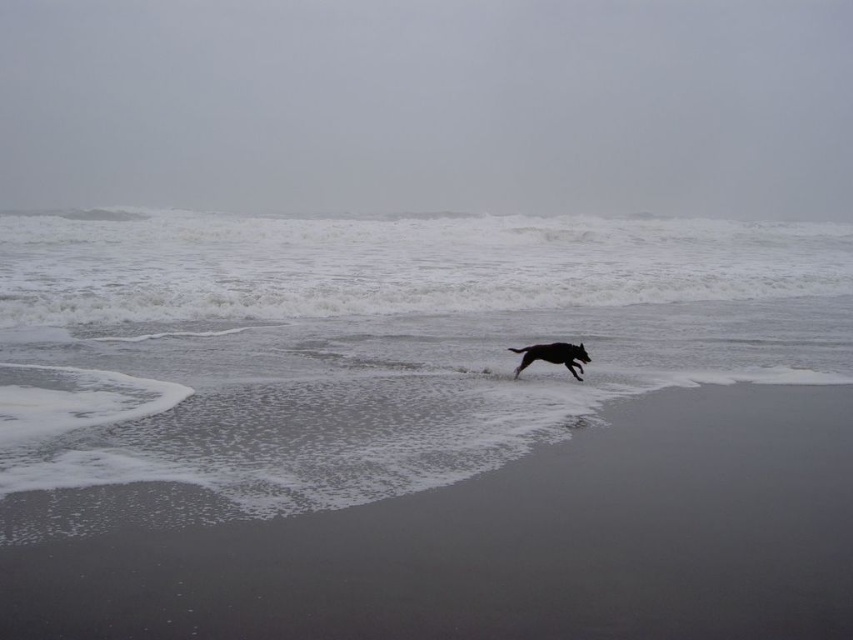
Question: Which of these objects is positioned closest to the gray sand at lower center?

Choices:
 (A) white frothy water at center
 (B) black glossy dog at center

Answer: (B)

Question: Which of the following is the farthest from the observer?

Choices:
 (A) gray sand at lower center
 (B) black glossy dog at center
 (C) white frothy water at center

Answer: (B)

Question: Is gray sand at lower center below black glossy dog at center?

Choices:
 (A) no
 (B) yes

Answer: (B)

Question: Does white frothy water at center appear on the left side of gray sand at lower center?

Choices:
 (A) no
 (B) yes

Answer: (B)

Question: Which of the following is the farthest from the observer?

Choices:
 (A) white frothy water at center
 (B) gray sand at lower center

Answer: (A)

Question: Can you confirm if gray sand at lower center is positioned to the right of black glossy dog at center?

Choices:
 (A) yes
 (B) no

Answer: (B)